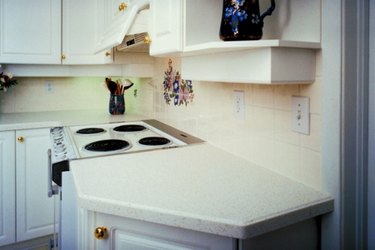
At what (x,y) coordinates should I click in order to perform the action: click on light switch. Please return your answer as a coordinate pair (x, y). The width and height of the screenshot is (375, 250). Looking at the image, I should click on (297, 115).